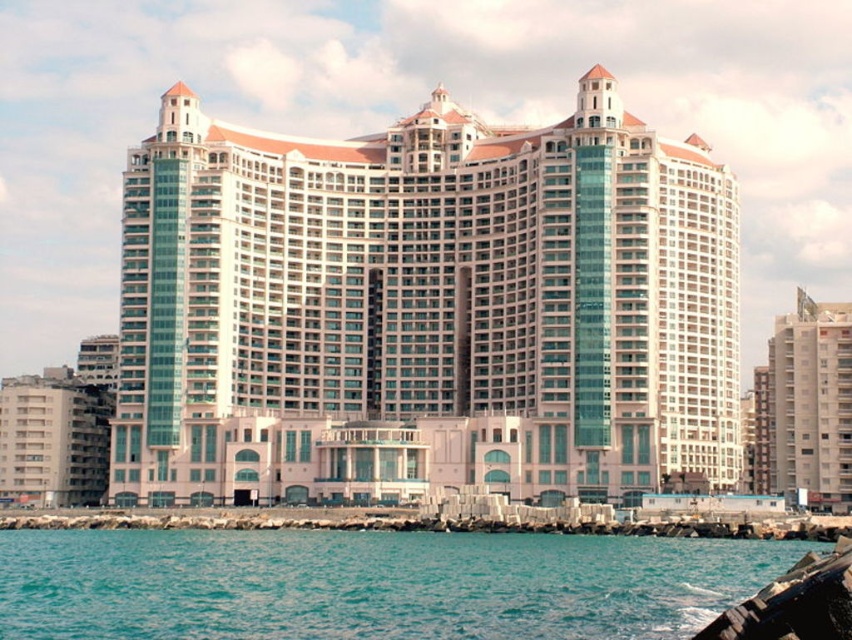
Which is more to the right, beige concrete building at right or gray concrete rocks at lower center?

From the viewer's perspective, beige concrete building at right appears more on the right side.

Which is below, beige concrete building at right or gray concrete rocks at lower center?

gray concrete rocks at lower center is below.

Where is `beige concrete building at right`? beige concrete building at right is located at coordinates (804, 406).

Is teal water at lower left above gray concrete rocks at lower center?

Yes.

Is point (447, 605) closer to camera compared to point (76, 528)?

Yes, it is.

I want to click on teal water at lower left, so click(372, 584).

Is teal water at lower left shorter than beige concrete building at lower left?

Yes.

Where is `teal water at lower left`? This screenshot has height=640, width=852. teal water at lower left is located at coordinates (372, 584).

Find the location of a particular element. The height and width of the screenshot is (640, 852). teal water at lower left is located at coordinates (x=372, y=584).